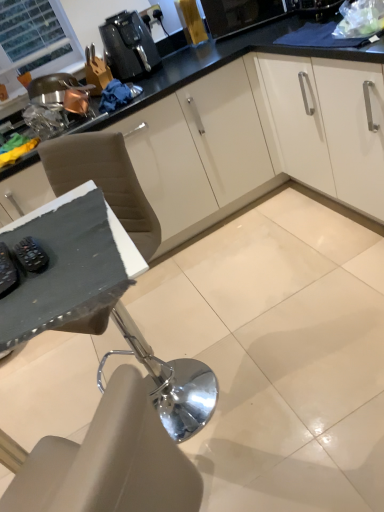
Question: Is black plastic coffee machine at upper center in front of or behind black rubber remote control at lower left, the first appliance viewed from the left, in the image?

Choices:
 (A) behind
 (B) front

Answer: (A)

Question: In the image, is black plastic coffee machine at upper center on the left side or the right side of black rubber remote control at lower left, the first appliance viewed from the left?

Choices:
 (A) right
 (B) left

Answer: (A)

Question: Which of these objects is positioned closest to the black plastic coffee machine at upper center?

Choices:
 (A) black rubber remote control at left, the second appliance in the left-to-right sequence
 (B) black rubber remote control at lower left, which appears as the 2th appliance when viewed from the right

Answer: (A)

Question: Which is farther from the black rubber remote control at lower left, which appears as the 2th appliance when viewed from the right?

Choices:
 (A) black rubber remote control at left, the second appliance in the left-to-right sequence
 (B) black plastic coffee machine at upper center

Answer: (B)